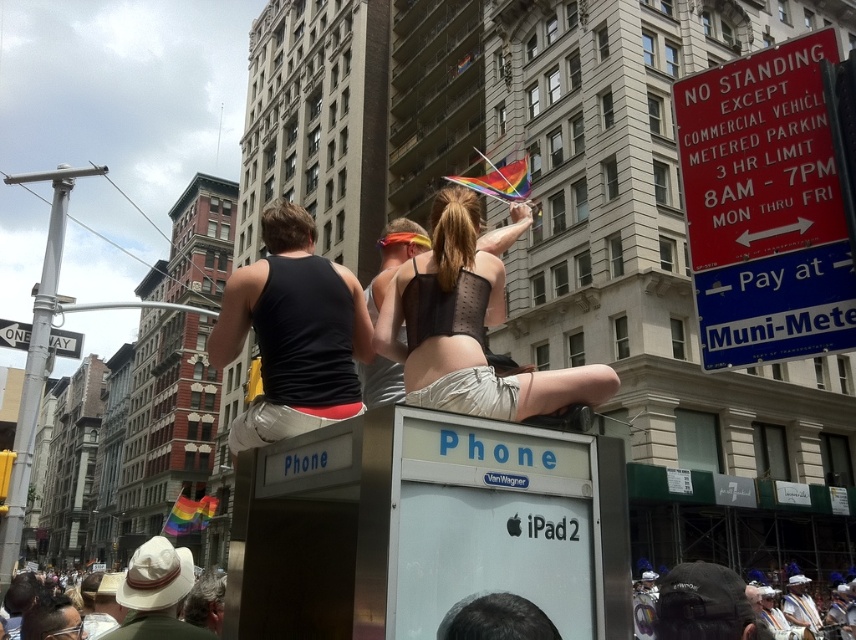
Question: Does black matte tank top at center come in front of matte black tank top at center?

Choices:
 (A) yes
 (B) no

Answer: (A)

Question: Considering the real-world distances, which object is closest to the white fabric hat at lower left?

Choices:
 (A) matte black tank top at center
 (B) black matte tank top at center
 (C) black mesh top at center
 (D) white cotton hat at lower center

Answer: (C)

Question: In this image, where is black matte tank top at center located relative to white cotton hat at lower center?

Choices:
 (A) right
 (B) left

Answer: (B)

Question: Considering the relative positions of black mesh top at center and white cotton hat at lower center in the image provided, where is black mesh top at center located with respect to white cotton hat at lower center?

Choices:
 (A) left
 (B) right

Answer: (A)

Question: Estimate the real-world distances between objects in this image. Which object is closer to the white fabric hat at lower left?

Choices:
 (A) white cotton hat at lower center
 (B) black matte tank top at center

Answer: (B)

Question: Estimate the real-world distances between objects in this image. Which object is farther from the black mesh top at center?

Choices:
 (A) white fabric hat at lower left
 (B) white cotton hat at lower center

Answer: (B)